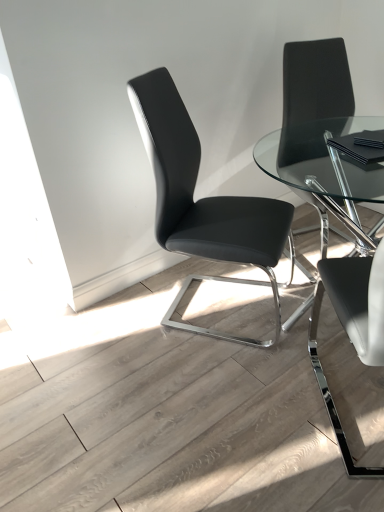
Find the location of a particular element. This screenshot has width=384, height=512. vacant space positioned to the left of black leather chair at right, the second chair in the left-to-right sequence is located at coordinates (251, 409).